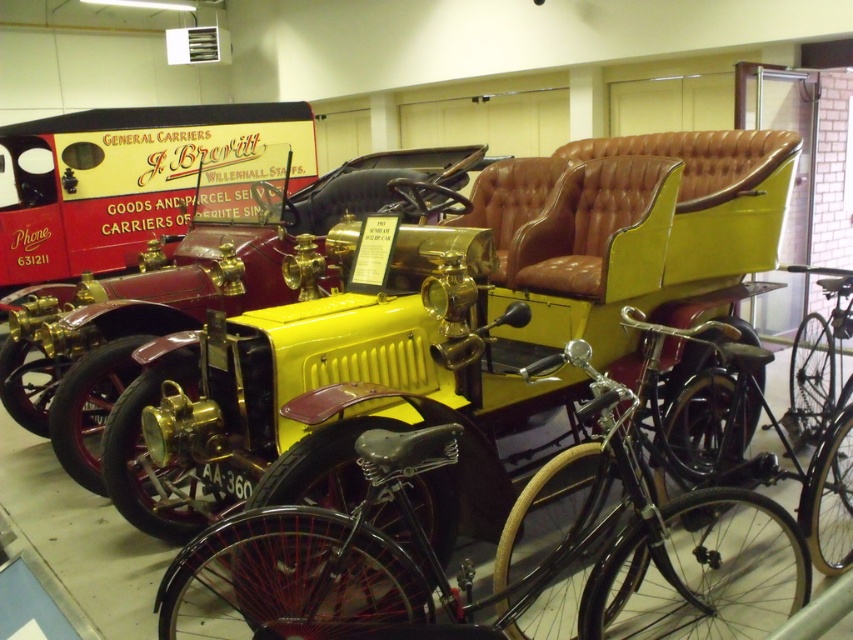
Question: Considering the relative positions of yellow matte car at center and black matte bicycle at center in the image provided, where is yellow matte car at center located with respect to black matte bicycle at center?

Choices:
 (A) left
 (B) right

Answer: (A)

Question: Can you confirm if yellow leather car at center is positioned above yellow matte car at center?

Choices:
 (A) no
 (B) yes

Answer: (A)

Question: Based on their relative distances, which object is farther from the yellow leather car at center?

Choices:
 (A) black matte bicycle at center
 (B) yellow matte car at center
 (C) shiny black bicycle at center

Answer: (B)

Question: Estimate the real-world distances between objects in this image. Which object is farther from the black matte bicycle at center?

Choices:
 (A) yellow matte car at center
 (B) shiny black bicycle at center
 (C) yellow leather car at center

Answer: (A)

Question: Is shiny black bicycle at center closer to the viewer compared to black matte bicycle at center?

Choices:
 (A) no
 (B) yes

Answer: (B)

Question: Which point is farther to the camera?

Choices:
 (A) (553, 336)
 (B) (830, 428)

Answer: (A)